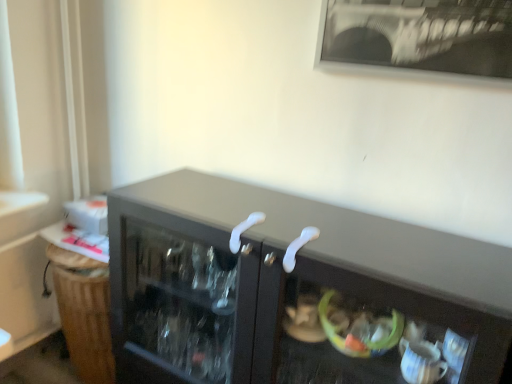
Question: Relative to white plastic door handle at center, the 1th door handle in the left-to-right sequence, is white plastic door handle at center, which is counted as the second door handle, starting from the left, in front or behind?

Choices:
 (A) front
 (B) behind

Answer: (A)

Question: From a real-world perspective, is white plastic door handle at center, which is counted as the second door handle, starting from the left, positioned above or below white plastic door handle at center, which is counted as the 2th door handle, starting from the right?

Choices:
 (A) above
 (B) below

Answer: (B)

Question: Do you think white plastic door handle at center, which is the 1th door handle in right-to-left order, is within white plastic door handle at center, which is counted as the 2th door handle, starting from the right, or outside of it?

Choices:
 (A) inside
 (B) outside

Answer: (B)

Question: From the image's perspective, is white plastic door handle at center, the 1th door handle in the left-to-right sequence, positioned above or below white plastic door handle at center, which is the 1th door handle in right-to-left order?

Choices:
 (A) below
 (B) above

Answer: (B)

Question: In the image, is white plastic door handle at center, the 1th door handle in the left-to-right sequence, positioned in front of or behind white plastic door handle at center, which is the 1th door handle in right-to-left order?

Choices:
 (A) front
 (B) behind

Answer: (B)

Question: Based on their sizes in the image, would you say white plastic door handle at center, which is counted as the 2th door handle, starting from the right, is bigger or smaller than white plastic door handle at center, which is the 1th door handle in right-to-left order?

Choices:
 (A) small
 (B) big

Answer: (A)

Question: Is white plastic door handle at center, the 1th door handle in the left-to-right sequence, inside the boundaries of white plastic door handle at center, which is the 1th door handle in right-to-left order, or outside?

Choices:
 (A) outside
 (B) inside

Answer: (A)